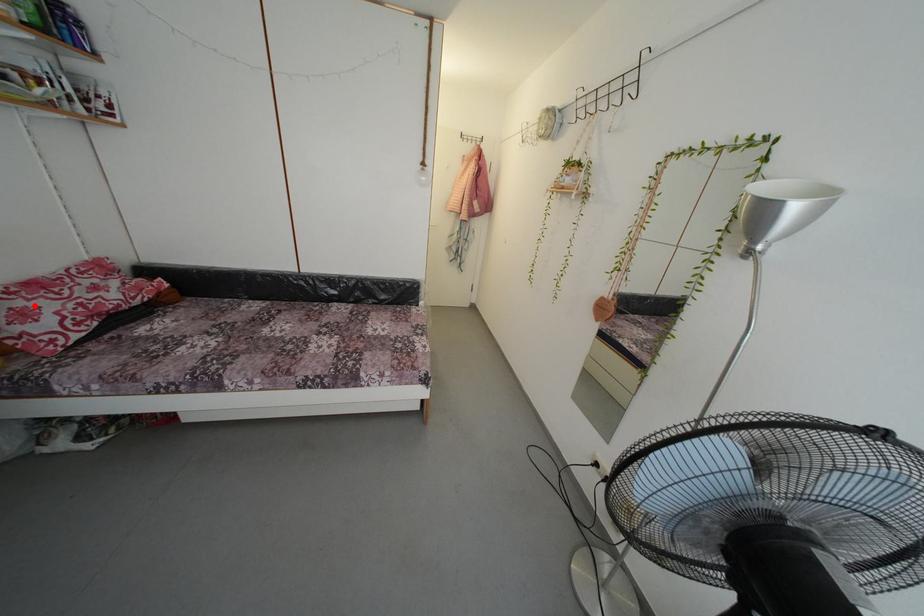
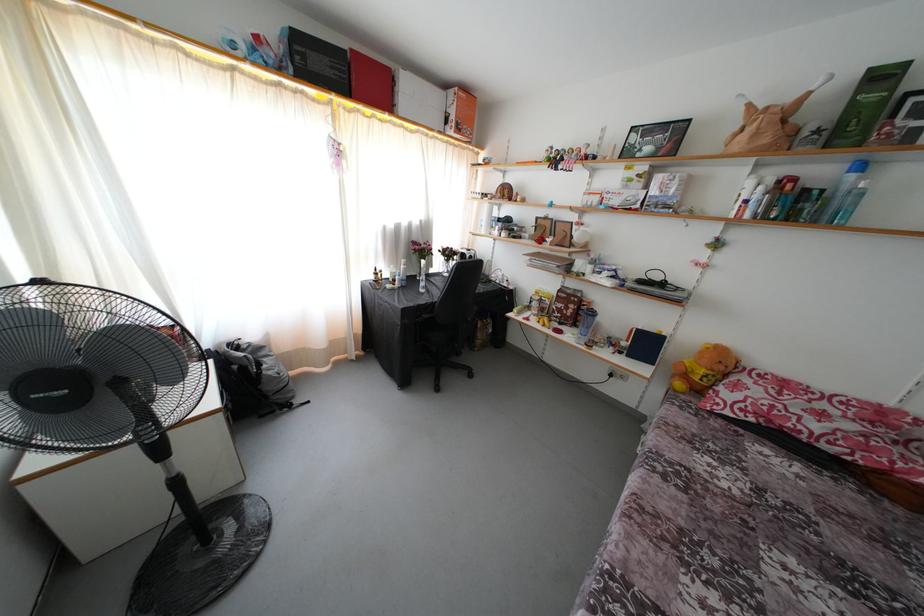
Find the pixel in the second image that matches the highlighted location in the first image.

(760, 389)